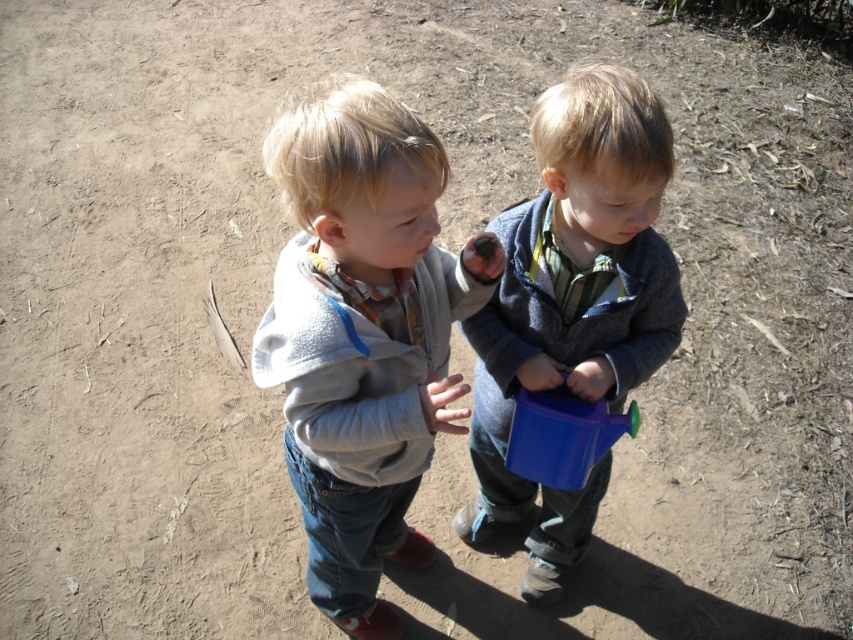
Is light gray fleece jacket at center taller than blue plastic watering can at center?

No, light gray fleece jacket at center is not taller than blue plastic watering can at center.

Between light gray fleece jacket at center and blue plastic watering can at center, which one has less height?

light gray fleece jacket at center is shorter.

Is point (379, 307) closer to viewer compared to point (456, 515)?

Yes, it is.

Identify the location of light gray fleece jacket at center. (363, 333).